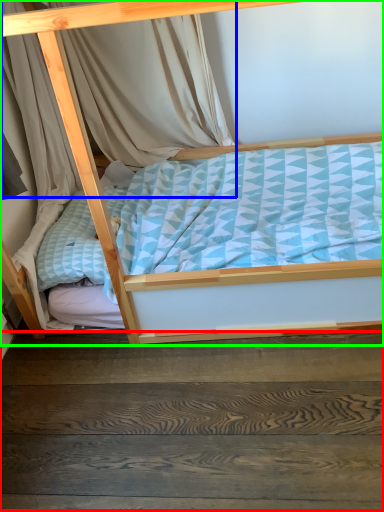
Question: Based on their relative distances, which object is farther from stairwell (highlighted by a red box)? Choose from curtain (highlighted by a blue box) and bed (highlighted by a green box).

Choices:
 (A) curtain
 (B) bed

Answer: (A)